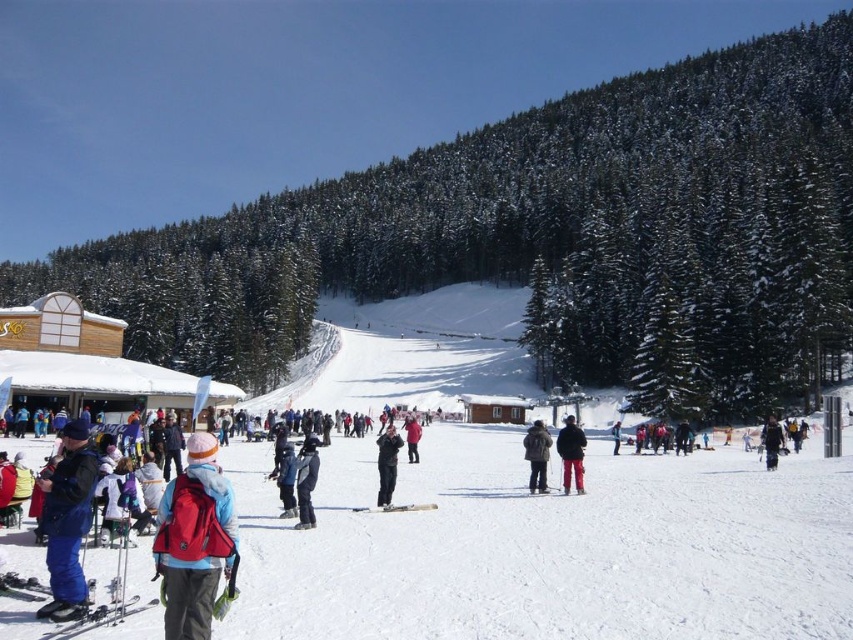
In the scene shown: Who is positioned more to the right, matte blue ski at lower left or metallic skis at lower left?

Positioned to the right is metallic skis at lower left.

Based on the photo, is matte blue ski at lower left taller than metallic skis at lower left?

Correct, matte blue ski at lower left is much taller as metallic skis at lower left.

Locate an element on the screen. This screenshot has width=853, height=640. matte blue ski at lower left is located at coordinates (102, 616).

Who is shorter, dark gray ski pants at center or dark gray jacket at center?

Standing shorter between the two is dark gray ski pants at center.

You are a GUI agent. You are given a task and a screenshot of the screen. Output one action in this format:
    pyautogui.click(x=<x>, y=<y>)
    Task: Click on the dark gray ski pants at center
    The image size is (853, 640).
    Given the screenshot: What is the action you would take?
    pyautogui.click(x=306, y=481)

Identify the location of dark gray ski pants at center. (306, 481).

Is black matte snowboarder at lower right in front of matte black jacket at center?

Yes, it is in front of matte black jacket at center.

The height and width of the screenshot is (640, 853). Describe the element at coordinates (770, 442) in the screenshot. I see `black matte snowboarder at lower right` at that location.

You are a GUI agent. You are given a task and a screenshot of the screen. Output one action in this format:
    pyautogui.click(x=<x>, y=<y>)
    Task: Click on the black matte snowboarder at lower right
    
    Given the screenshot: What is the action you would take?
    pyautogui.click(x=770, y=442)